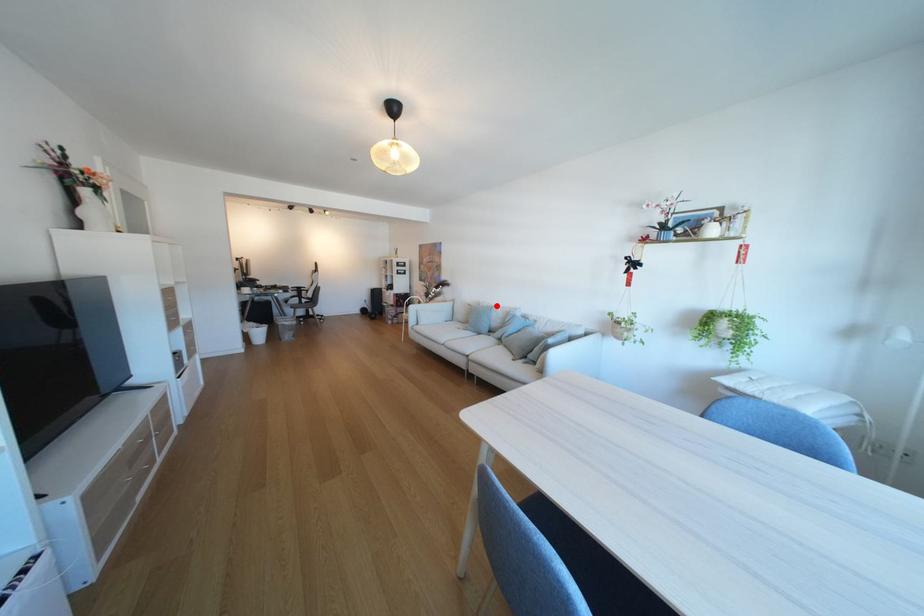
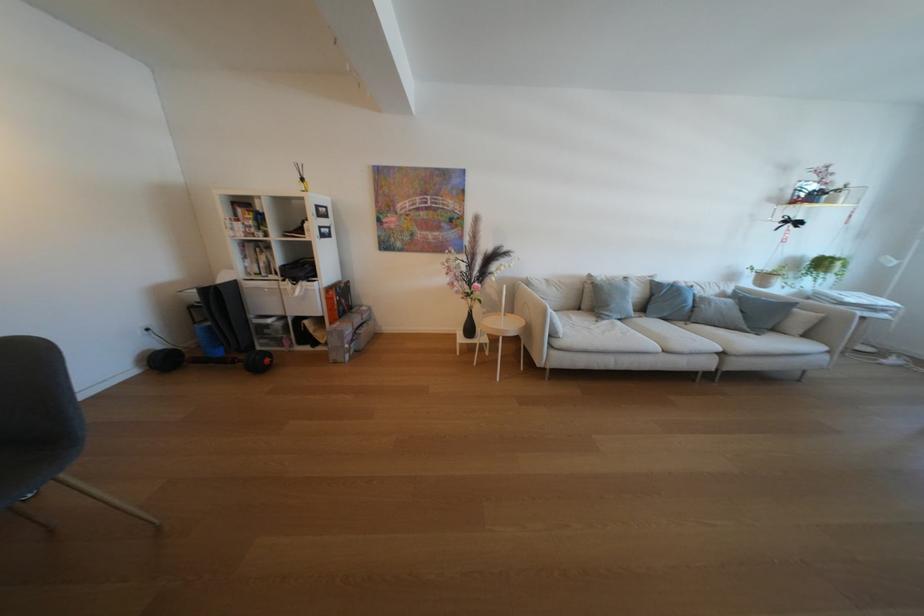
Question: I am providing you with two images of the same scene from different viewpoints. Given a red point in image1, look at the same physical point in image2. Is it:

Choices:
 (A) Closer to the viewpoint
 (B) Farther from the viewpoint

Answer: (A)